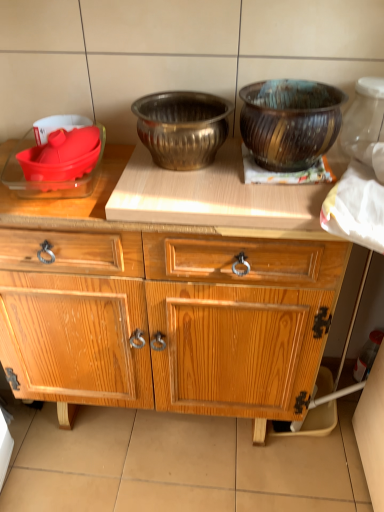
Question: In the image, is brushed metal bowl at center, the second bowl from the right, positioned in front of or behind wooden cabinet at center?

Choices:
 (A) front
 (B) behind

Answer: (B)

Question: Based on their sizes in the image, would you say brushed metal bowl at center, the second bowl from the right, is bigger or smaller than wooden cabinet at center?

Choices:
 (A) big
 (B) small

Answer: (B)

Question: Which object is the farthest from the brushed metal bowl at center, the second bowl from the right?

Choices:
 (A) wooden textured bowl at upper right, which appears as the first bowl when viewed from the right
 (B) matte red bowl at upper left, which is counted as the fourth bowl, starting from the right
 (C) translucent glass jar at upper right
 (D) wooden cabinet at center
 (E) matte red bowl at left, marked as the second bowl in a left-to-right arrangement

Answer: (C)

Question: Estimate the real-world distances between objects in this image. Which object is closer to the wooden textured bowl at upper right, which appears as the first bowl when viewed from the right?

Choices:
 (A) translucent glass jar at upper right
 (B) brushed metal bowl at center, the 3th bowl viewed from the left
 (C) wooden cabinet at center
 (D) matte red bowl at left, placed as the third bowl when sorted from right to left
 (E) matte red bowl at upper left, the first bowl viewed from the left

Answer: (B)